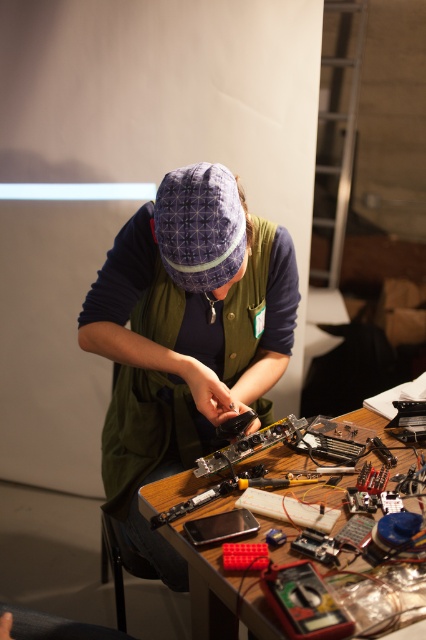
Who is shorter, purple fabric cap at upper center or wooden table at center?

With less height is wooden table at center.

Which is in front, point (201, 349) or point (305, 467)?

Positioned in front is point (305, 467).

Between point (230, 339) and point (400, 458), which one is positioned in front?

Point (400, 458) is in front.

Identify the location of purple fabric cap at upper center. Image resolution: width=426 pixels, height=640 pixels. (186, 336).